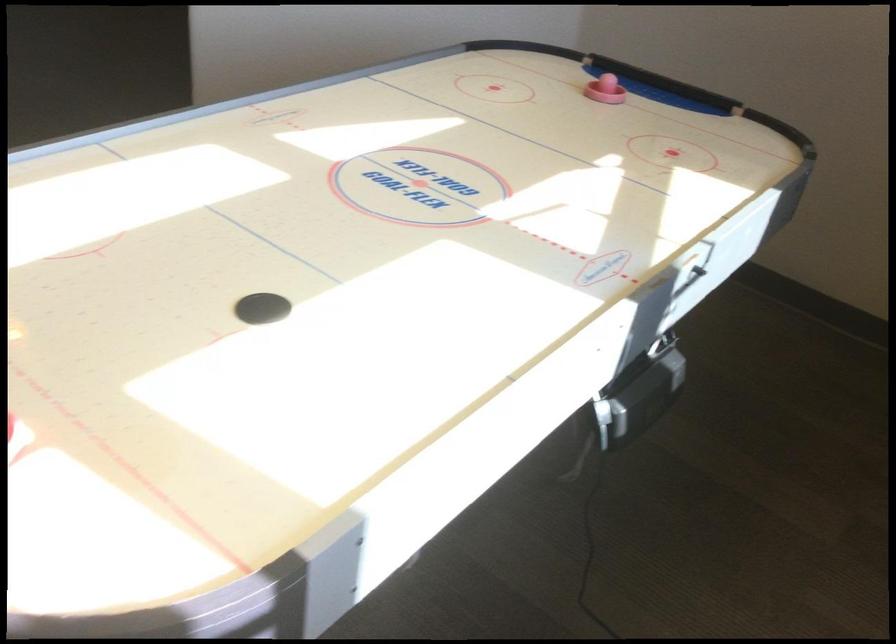
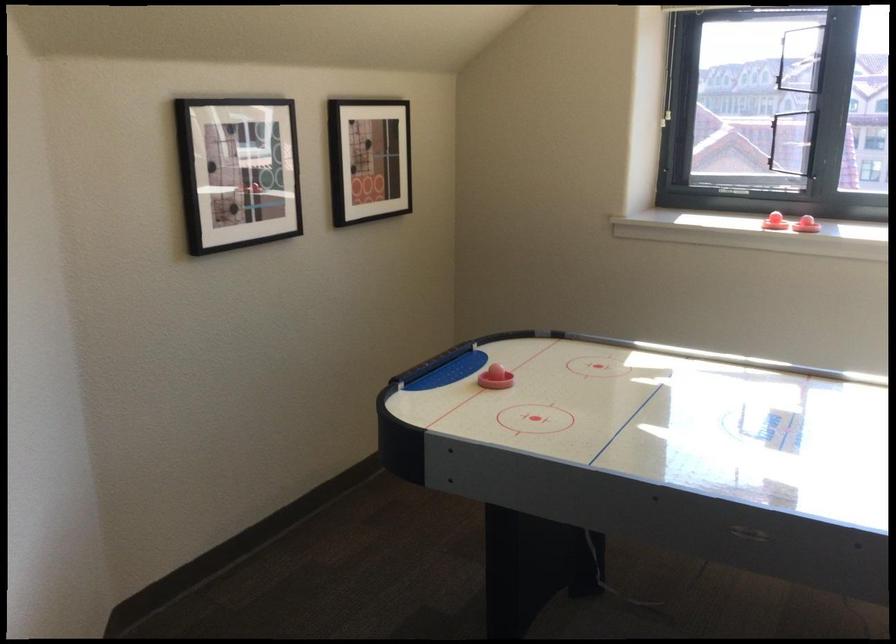
Where in the second image is the point corresponding to the point at 573,96 from the first image?

(495, 379)